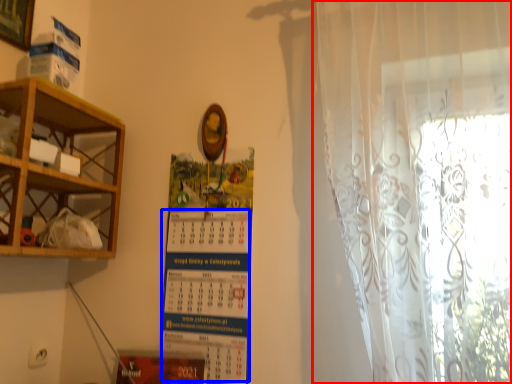
Question: Among these objects, which one is nearest to the camera, curtain (highlighted by a red box) or writing (highlighted by a blue box)?

Choices:
 (A) curtain
 (B) writing

Answer: (A)